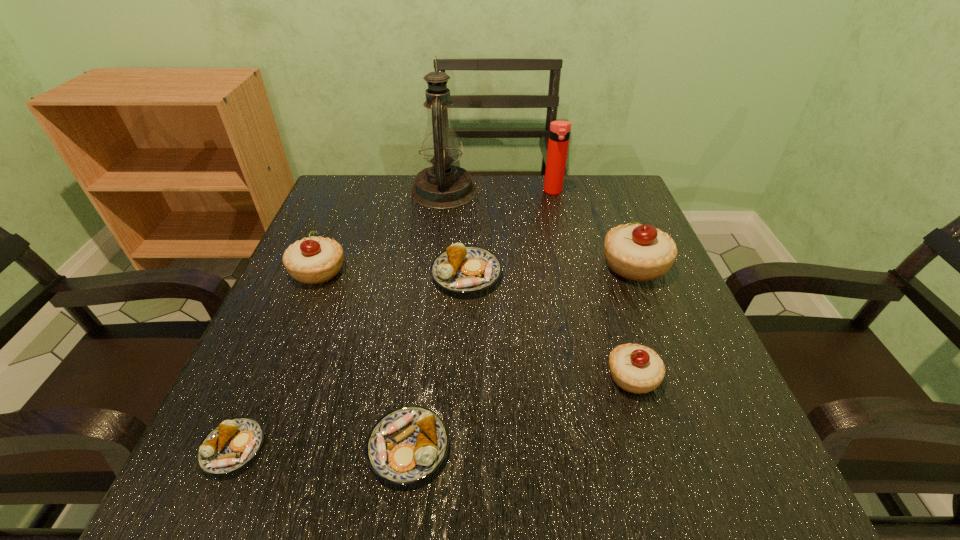
The width and height of the screenshot is (960, 540). What are the coordinates of `the fifth tallest pastry` in the screenshot? It's located at (407, 445).

This screenshot has height=540, width=960. I want to click on the second smallest brown pastry, so click(x=407, y=445).

You are a GUI agent. You are given a task and a screenshot of the screen. Output one action in this format:
    pyautogui.click(x=<x>, y=<y>)
    Task: Click on the shortest object
    
    Given the screenshot: What is the action you would take?
    pyautogui.click(x=234, y=443)

Locate an element on the screen. the smallest brown pastry is located at coordinates (234, 443).

Locate an element on the screen. free space located on the front of the oil lamp is located at coordinates (437, 252).

This screenshot has height=540, width=960. I want to click on vacant space situated 0.120m on the front of the second tallest object, so click(x=561, y=224).

Locate an element on the screen. This screenshot has height=540, width=960. vacant region located on the back of the third tallest object is located at coordinates (620, 228).

Locate an element on the screen. This screenshot has width=960, height=540. vacant region located on the front of the leftmost beige pastry is located at coordinates (271, 385).

Where is `vacant space located 0.390m on the back of the nearest beige pastry`? The image size is (960, 540). vacant space located 0.390m on the back of the nearest beige pastry is located at coordinates pos(587,226).

Locate an element on the screen. The image size is (960, 540). free space located on the front of the third shortest object is located at coordinates (464, 365).